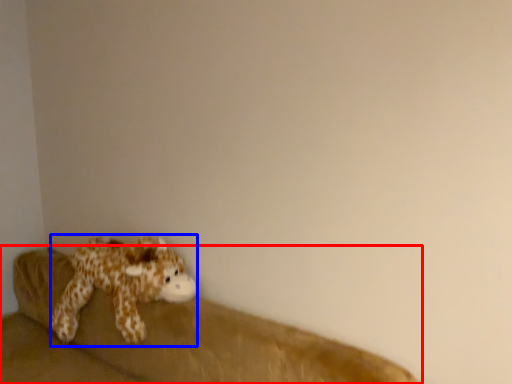
Question: Which of the following is the closest to the observer, studio couch (highlighted by a red box) or toy (highlighted by a blue box)?

Choices:
 (A) studio couch
 (B) toy

Answer: (A)